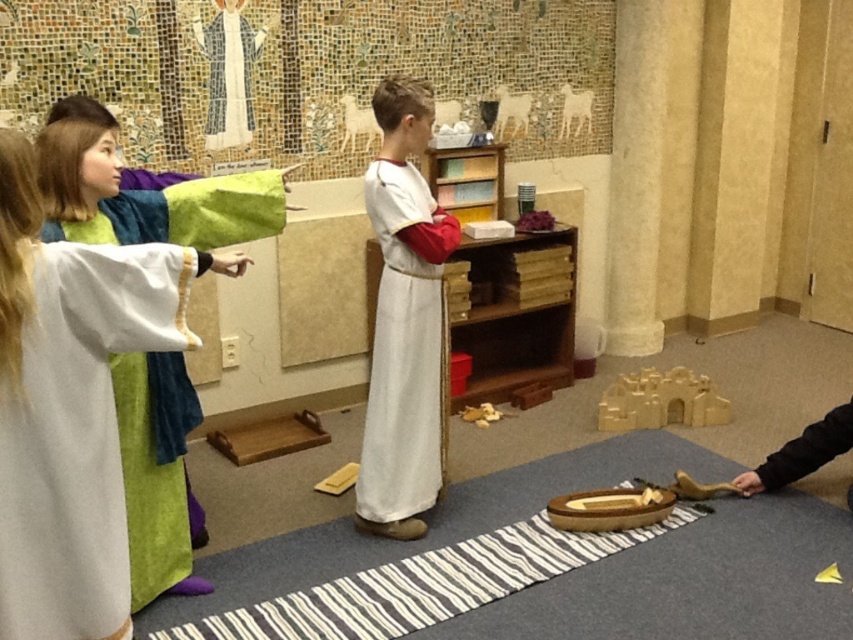
You are an observer standing in the center of the room. You see a point marked at coordinates (155, 470). According to the scene description, what object is located at that point?

The point at coordinates (155, 470) indicates the location of the white soft fabric robe at left.

You are a costume designer preparing for a play. You have two costumes in the scene, a white soft fabric robe at left and a white cotton dress at center. The director wants to know if they can stand side by side without overlapping. The minimum required space between them is 1 meter. Can they achieve this?

The white soft fabric robe at left and white cotton dress at center are 76.80 centimeters apart from each other. Since 76.80 cm is less than 1 meter, they cannot stand side by side without overlapping as the required space is not met.

Based on the photo, you are a photographer trying to capture a group photo of the children in the scene. You need to position yourself so that you can see both the white soft fabric robe at left and the white cotton dress at center. Based on their positions, which side should you stand relative to the children to ensure both are in frame?

You should stand to the right side of the children because the white soft fabric robe at left is to the left of the white cotton dress at center, so positioning yourself to the right will allow both to be visible in the frame.